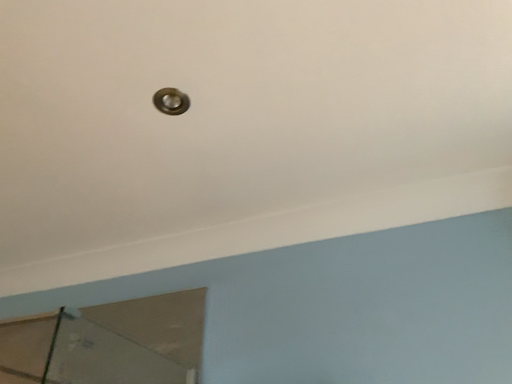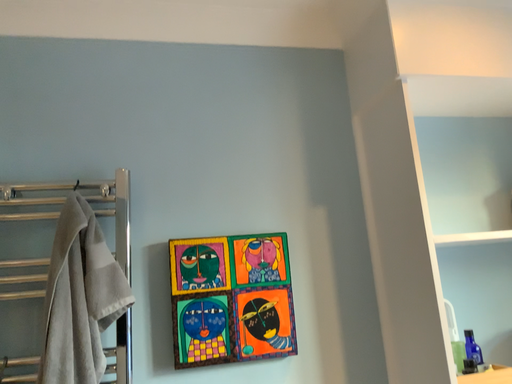
Question: Which way did the camera rotate in the video?

Choices:
 (A) rotated left
 (B) rotated right

Answer: (B)